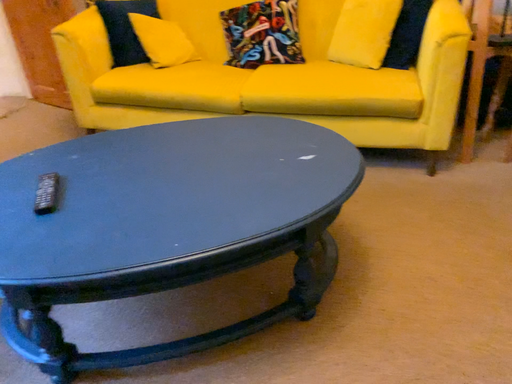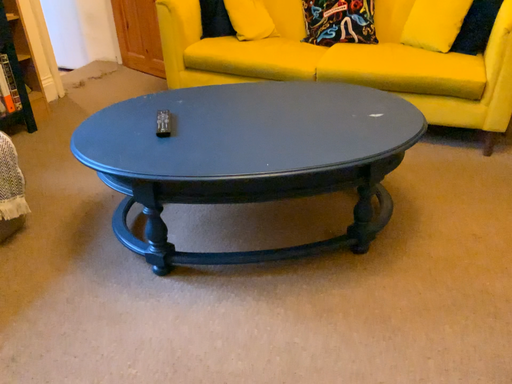
Question: How did the camera likely rotate when shooting the video?

Choices:
 (A) rotated left
 (B) rotated right

Answer: (A)